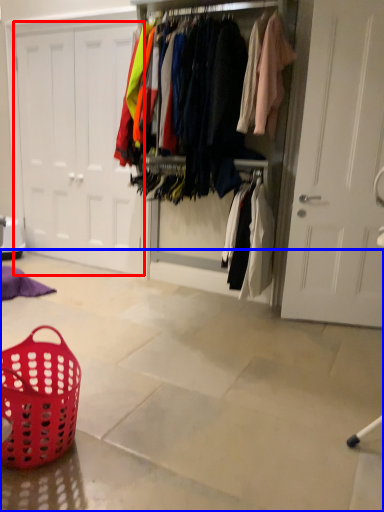
Question: Among these objects, which one is farthest to the camera, door (highlighted by a red box) or concrete (highlighted by a blue box)?

Choices:
 (A) door
 (B) concrete

Answer: (A)